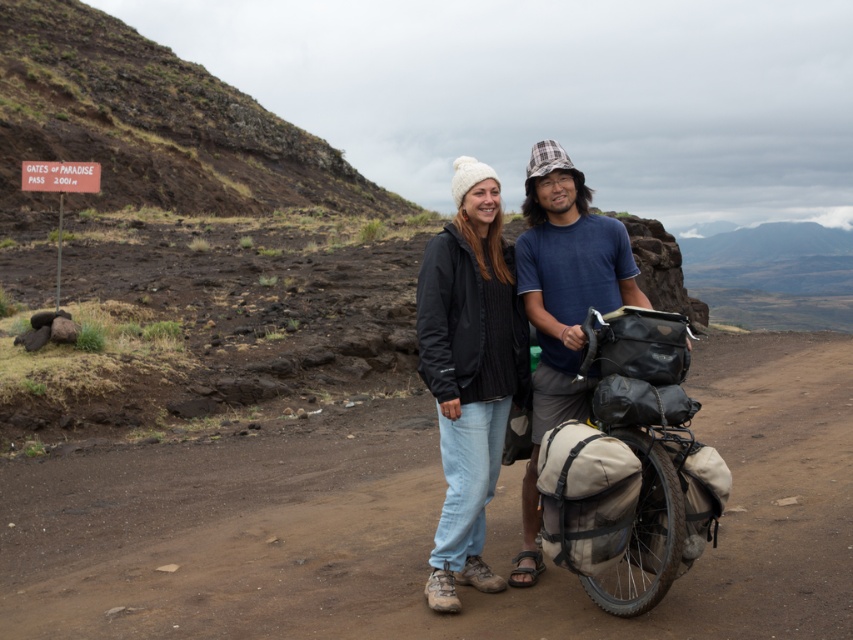
Question: Among these points, which one is nearest to the camera?

Choices:
 (A) (450, 497)
 (B) (540, 156)
 (C) (62, 145)

Answer: (A)

Question: Estimate the real-world distances between objects in this image. Which object is closer to the matte black jacket at center?

Choices:
 (A) brown dirt track at center
 (B) black fleece jacket at center

Answer: (B)

Question: Can you confirm if brown rocky hillside at upper left is thinner than black fleece jacket at center?

Choices:
 (A) no
 (B) yes

Answer: (A)

Question: From the image, what is the correct spatial relationship of brown rocky hillside at upper left in relation to matte black jacket at center?

Choices:
 (A) right
 (B) left

Answer: (B)

Question: Can you confirm if black fleece jacket at center is positioned below matte black jacket at center?

Choices:
 (A) no
 (B) yes

Answer: (A)

Question: Among these objects, which one is farthest from the camera?

Choices:
 (A) matte black jacket at center
 (B) brown dirt track at center
 (C) black fleece jacket at center
 (D) blue cotton shirt at center

Answer: (D)